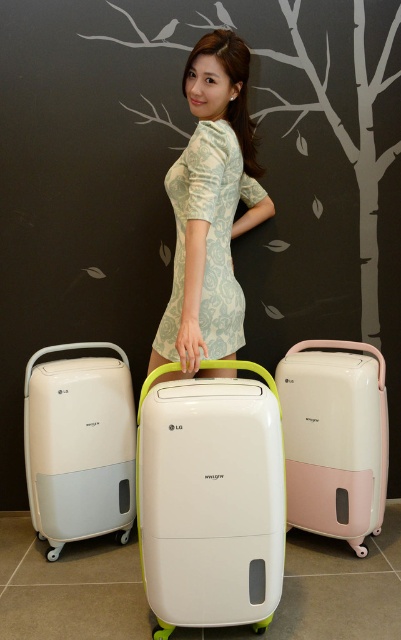
You are a delivery person who needs to place a new dehumidifier that is 18 inches wide into the space between the light blue floral dress at center and the white matte dehumidifier at left. Will there be enough space for it?

The distance between the light blue floral dress at center and the white matte dehumidifier at left is 21.16 inches. Since the new dehumidifier is 18 inches wide, there is enough space to place it between them.

You are a delivery person who needs to place a white matte suitcase at center and a light blue floral dress at center in a storage locker. The locker has a width of 20 inches. Can both items fit side by side without overlapping?

The white matte suitcase at center and light blue floral dress at center are 16.88 inches apart from each other. Since the locker is 20 inches wide, there is enough space to fit both items side by side without overlapping.